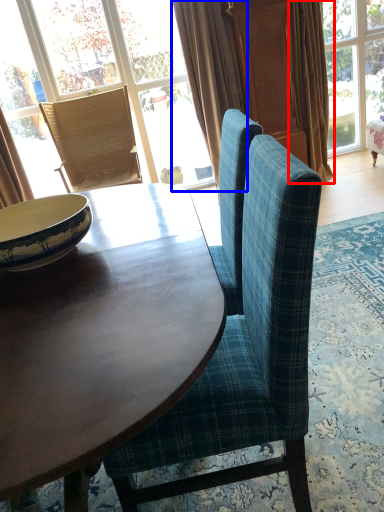
Question: Which object appears closest to the camera in this image, curtain (highlighted by a red box) or curtain (highlighted by a blue box)?

Choices:
 (A) curtain
 (B) curtain

Answer: (B)